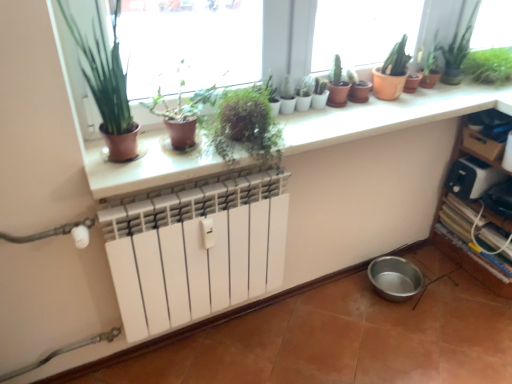
Question: Considering the relative sizes of white plastic toaster at right and green matte plant at upper center, arranged as the fourth houseplant when viewed from the right, in the image provided, is white plastic toaster at right smaller than green matte plant at upper center, arranged as the fourth houseplant when viewed from the right,?

Choices:
 (A) yes
 (B) no

Answer: (A)

Question: From a real-world perspective, is white plastic toaster at right physically below green matte plant at upper center, marked as the 3th houseplant in a left-to-right arrangement?

Choices:
 (A) yes
 (B) no

Answer: (A)

Question: Can you confirm if white plastic toaster at right is positioned to the left of green matte plant at upper center, marked as the 3th houseplant in a left-to-right arrangement?

Choices:
 (A) no
 (B) yes

Answer: (A)

Question: Considering the relative sizes of white plastic toaster at right and green matte plant at upper center, arranged as the fourth houseplant when viewed from the right, in the image provided, is white plastic toaster at right shorter than green matte plant at upper center, arranged as the fourth houseplant when viewed from the right,?

Choices:
 (A) yes
 (B) no

Answer: (A)

Question: Can you confirm if white plastic toaster at right is thinner than green matte plant at upper center, marked as the 3th houseplant in a left-to-right arrangement?

Choices:
 (A) yes
 (B) no

Answer: (A)

Question: Would you say white plastic toaster at right is a long distance from green matte plant at upper center, arranged as the fourth houseplant when viewed from the right?

Choices:
 (A) yes
 (B) no

Answer: (A)

Question: Is green matte plant at center, arranged as the 2th houseplant when viewed from the left, taller than green matte plant at upper left?

Choices:
 (A) yes
 (B) no

Answer: (B)

Question: Considering the relative sizes of green matte plant at center, acting as the fifth houseplant starting from the right, and green matte plant at upper left in the image provided, is green matte plant at center, acting as the fifth houseplant starting from the right, smaller than green matte plant at upper left?

Choices:
 (A) no
 (B) yes

Answer: (B)

Question: From the image's perspective, does green matte plant at center, arranged as the 2th houseplant when viewed from the left, appear higher than green matte plant at upper left?

Choices:
 (A) no
 (B) yes

Answer: (A)

Question: Considering the relative sizes of green matte plant at center, acting as the fifth houseplant starting from the right, and green matte plant at upper left in the image provided, is green matte plant at center, acting as the fifth houseplant starting from the right, shorter than green matte plant at upper left?

Choices:
 (A) no
 (B) yes

Answer: (B)

Question: Is green matte plant at center, arranged as the 2th houseplant when viewed from the left, wider than green matte plant at upper left?

Choices:
 (A) yes
 (B) no

Answer: (A)

Question: Does green matte plant at center, acting as the fifth houseplant starting from the right, turn towards green matte plant at upper left?

Choices:
 (A) yes
 (B) no

Answer: (B)

Question: From a real-world perspective, is wooden shelf at lower right on green glossy plant at upper right?

Choices:
 (A) no
 (B) yes

Answer: (A)